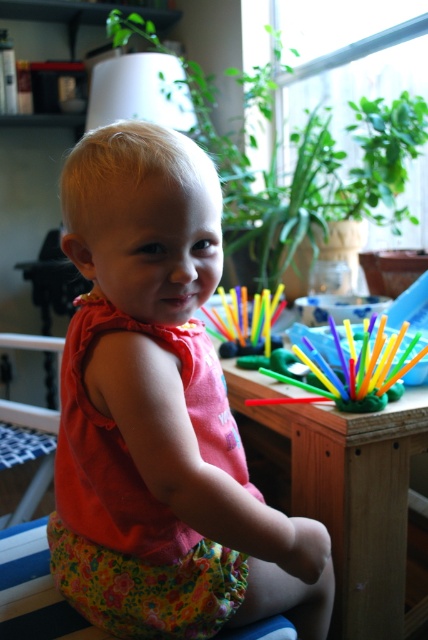
Does wooden table at center have a larger size compared to multicolored plastic straws at center?

Correct, wooden table at center is larger in size than multicolored plastic straws at center.

Is point (389, 621) closer to camera compared to point (240, 365)?

Yes, point (389, 621) is in front of point (240, 365).

Where is `wooden table at center`? The height and width of the screenshot is (640, 428). wooden table at center is located at coordinates (341, 488).

Identify the location of wooden table at center. (341, 488).

Is multicolored plastic straws at center above floral fabric chair at lower left?

Indeed, multicolored plastic straws at center is positioned over floral fabric chair at lower left.

Who is more distant from viewer, (x=238, y=364) or (x=17, y=509)?

The point (x=17, y=509) is more distant.

The width and height of the screenshot is (428, 640). What are the coordinates of `multicolored plastic straws at center` in the screenshot? It's located at (347, 365).

Can you confirm if pink fabric dress at center is taller than floral fabric chair at lower left?

Yes, pink fabric dress at center is taller than floral fabric chair at lower left.

Does pink fabric dress at center appear under floral fabric chair at lower left?

No.

Between point (223, 438) and point (8, 342), which one is positioned in front?

Point (223, 438)

Locate an element on the screen. pink fabric dress at center is located at coordinates (160, 413).